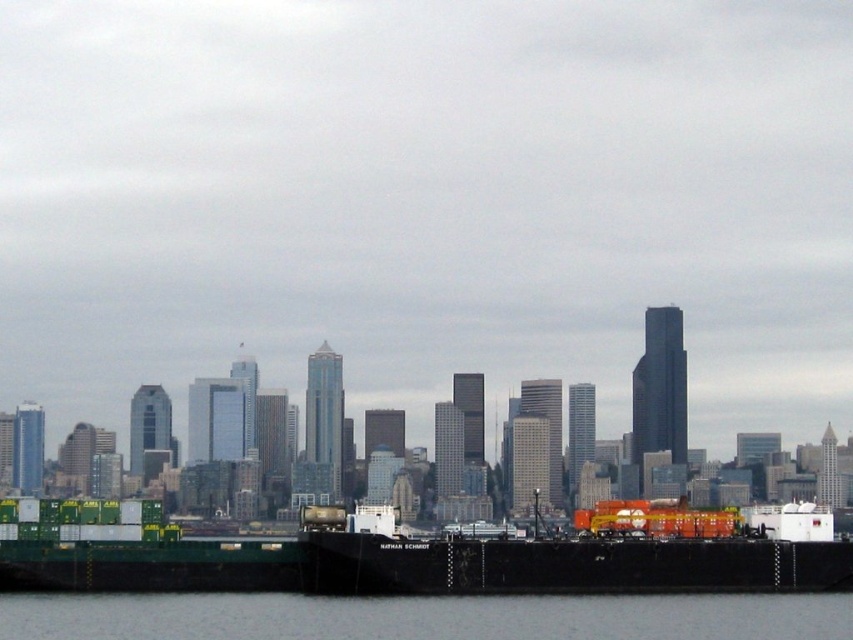
Question: Does black matte barge at lower center have a greater width compared to gray water at lower center?

Choices:
 (A) no
 (B) yes

Answer: (A)

Question: Is black matte barge at lower center positioned behind gray water at lower center?

Choices:
 (A) yes
 (B) no

Answer: (B)

Question: Can you confirm if black matte barge at lower center is positioned to the right of gray water at lower center?

Choices:
 (A) yes
 (B) no

Answer: (A)

Question: Which object appears closest to the camera in this image?

Choices:
 (A) black matte barge at lower center
 (B) gray water at lower center

Answer: (A)